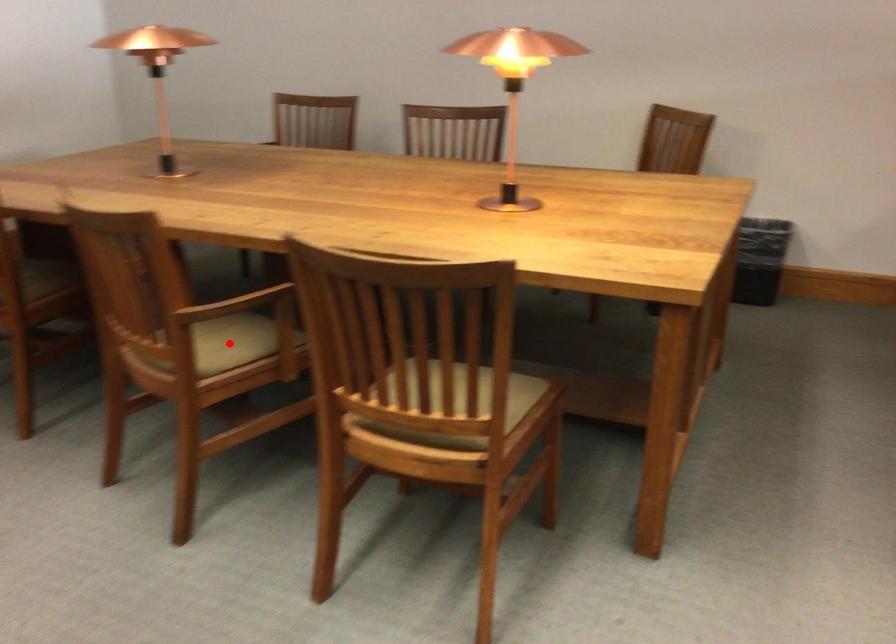
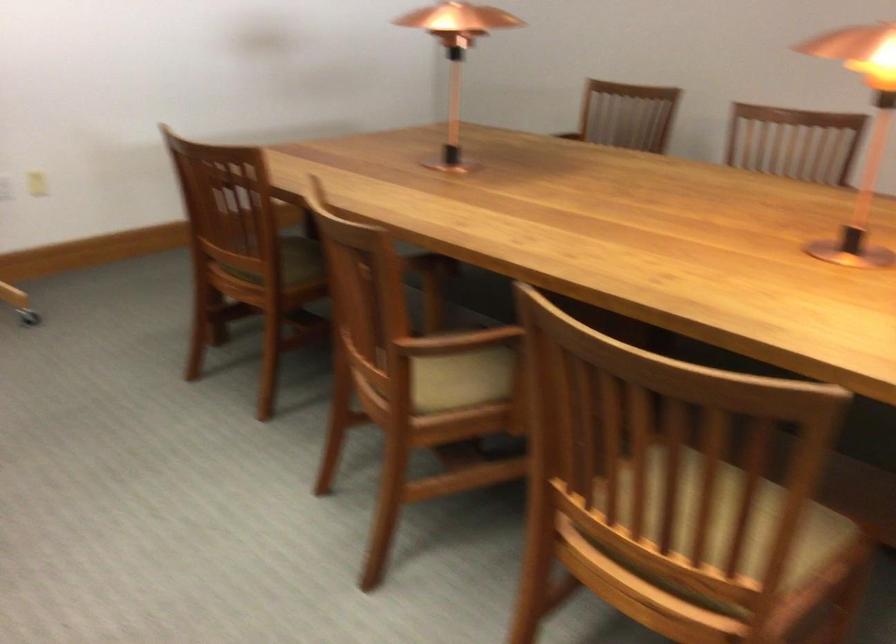
Question: I am providing you with two images of the same scene from different viewpoints. Image1 has a red point marked. In image2, the corresponding 3D location appears at what relative position? Reply with the corresponding letter.

Choices:
 (A) Closer
 (B) Farther

Answer: (A)